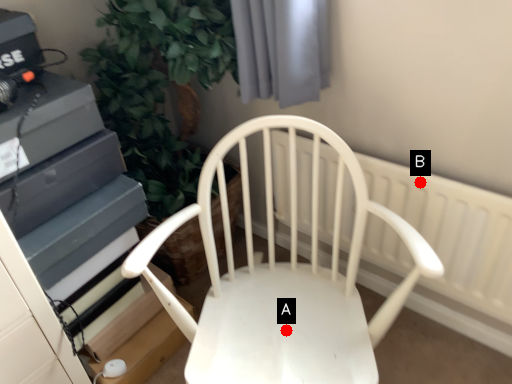
Question: Two points are circled on the image, labeled by A and B beside each circle. Which point is closer to the camera taking this photo?

Choices:
 (A) A is closer
 (B) B is closer

Answer: (A)